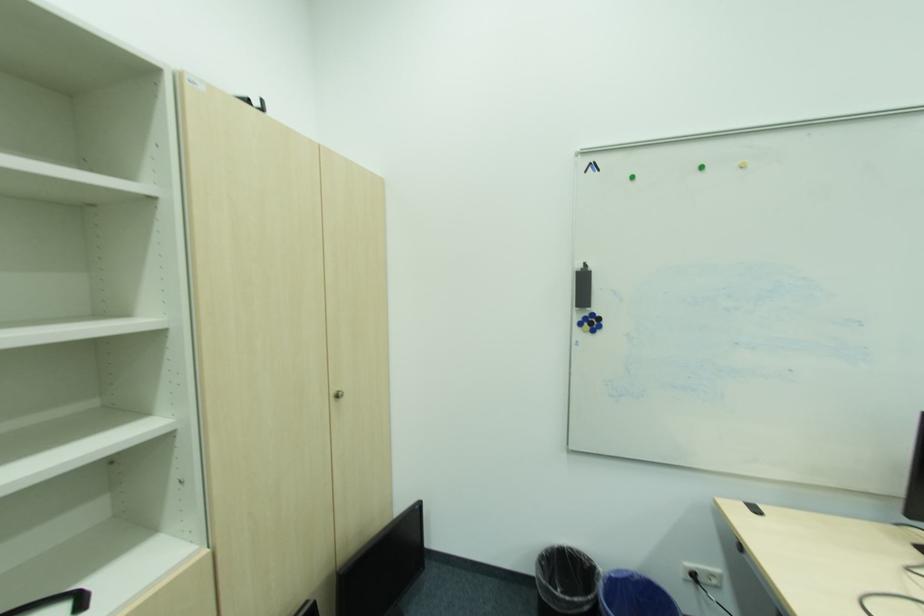
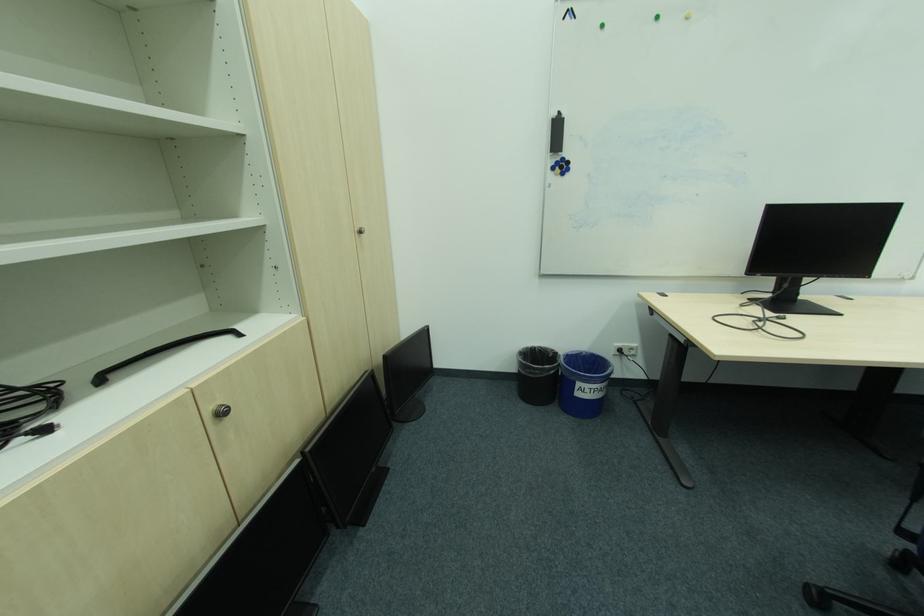
Find the pixel in the second image that matches point 591,318 in the first image.

(565, 163)